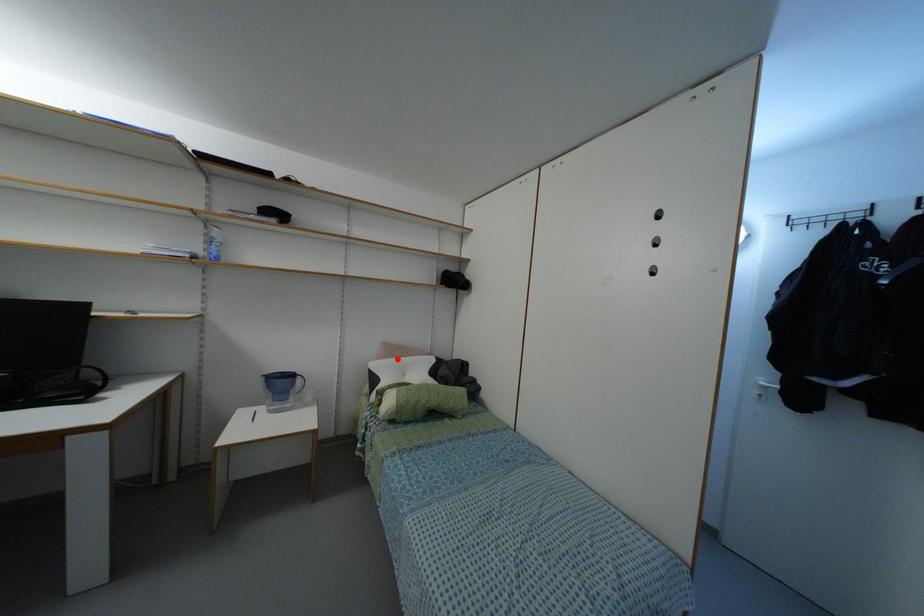
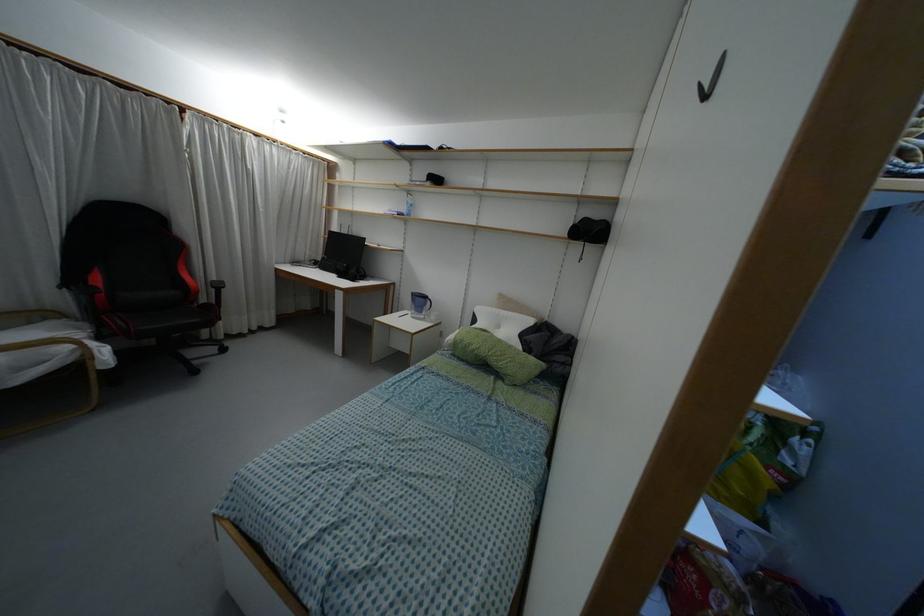
Locate, in the second image, the point that corresponds to the highlighted location in the first image.

(496, 310)